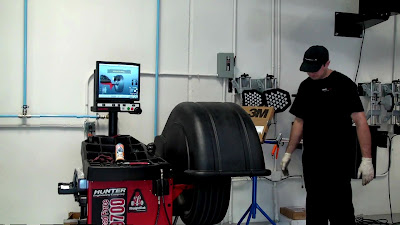
Locate an element on the screen. The height and width of the screenshot is (225, 400). brown box is located at coordinates (262, 121).